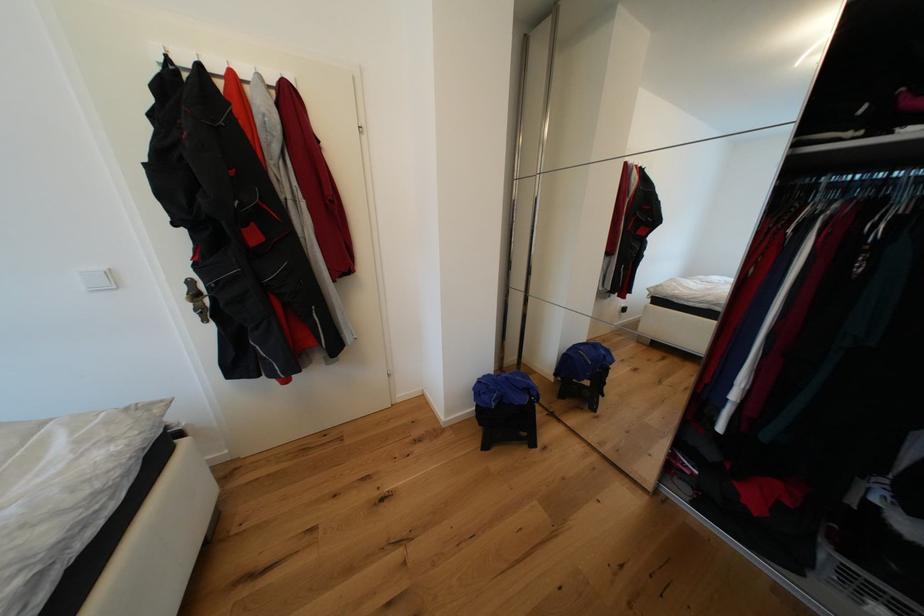
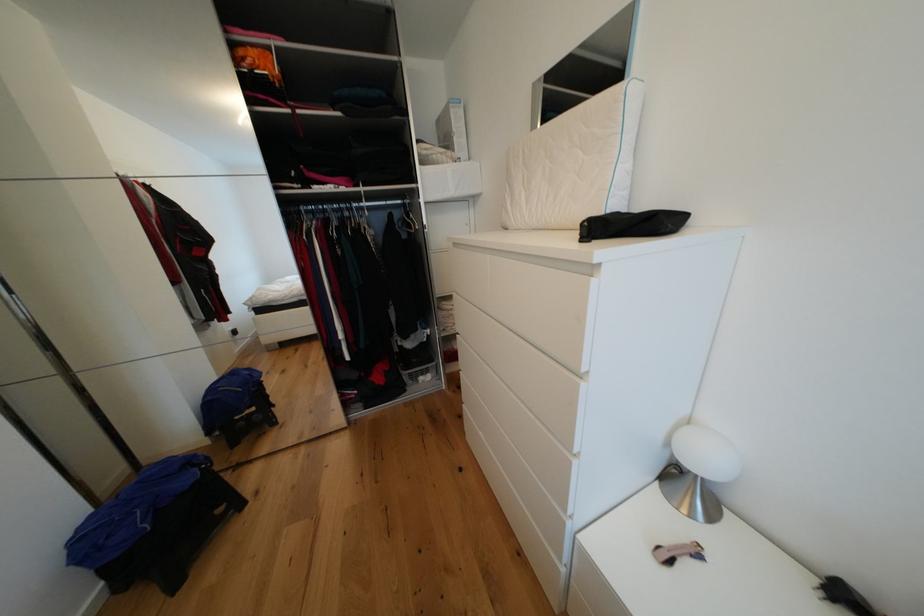
Based on the continuous images, in which direction is the camera rotating?

The camera rotated toward right-down.